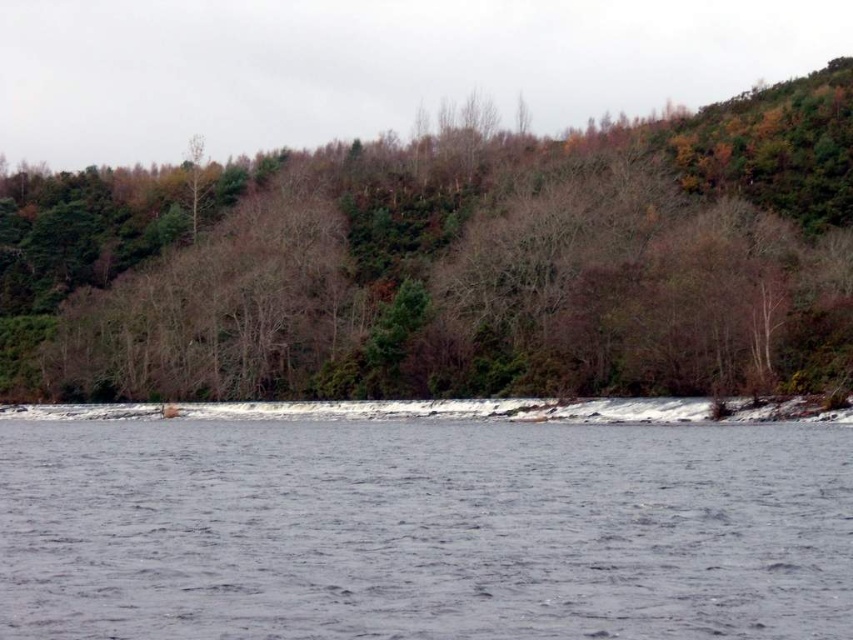
Question: Which point is farther to the camera?

Choices:
 (A) gray water at center
 (B) brown leafless tree at center

Answer: (B)

Question: Is brown leafless tree at center in front of gray water at center?

Choices:
 (A) yes
 (B) no

Answer: (B)

Question: Is brown leafless tree at center in front of gray water at center?

Choices:
 (A) yes
 (B) no

Answer: (B)

Question: Does brown leafless tree at center have a greater width compared to gray water at center?

Choices:
 (A) no
 (B) yes

Answer: (B)